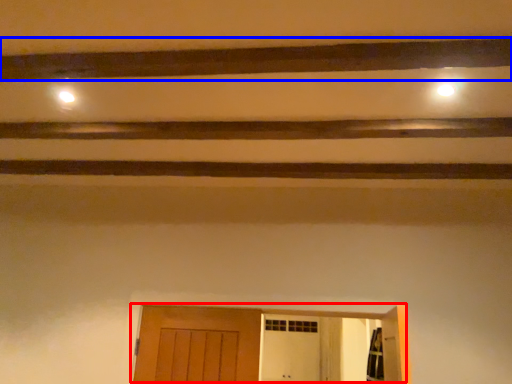
Question: Which object is further to the camera taking this photo, door (highlighted by a red box) or plank (highlighted by a blue box)?

Choices:
 (A) door
 (B) plank

Answer: (A)